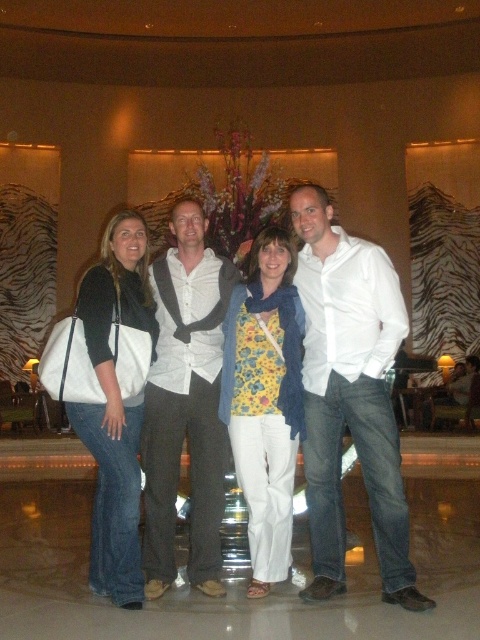
Question: Which point is closer to the camera?

Choices:
 (A) white matte shirt at center
 (B) matte white tote at left
 (C) white cotton shirt at center

Answer: (C)

Question: Which of the following is the closest to the observer?

Choices:
 (A) matte white tote at left
 (B) floral print fabric at center
 (C) white cotton shirt at center
 (D) white matte shirt at center

Answer: (C)

Question: Can you confirm if white cotton shirt at center is wider than matte white tote at left?

Choices:
 (A) no
 (B) yes

Answer: (B)

Question: Based on their relative distances, which object is nearer to the white matte shirt at center?

Choices:
 (A) floral print fabric at center
 (B) white cotton shirt at center
 (C) matte white tote at left

Answer: (C)

Question: Is white cotton shirt at center wider than white matte shirt at center?

Choices:
 (A) no
 (B) yes

Answer: (B)

Question: Is floral print fabric at center positioned before matte white tote at left?

Choices:
 (A) no
 (B) yes

Answer: (A)